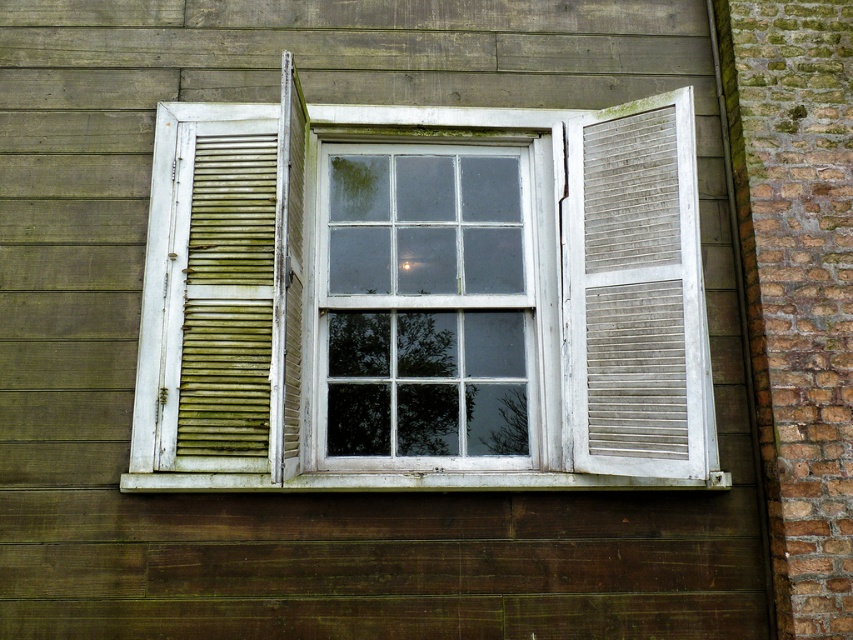
Locate an element on the screen. The height and width of the screenshot is (640, 853). white wood window at center is located at coordinates (422, 298).

Is point (436, 381) positioned behind point (717, 476)?

Yes, point (436, 381) is farther from viewer.

Who is more distant from viewer, (223, 385) or (560, 490)?

The point (223, 385) is behind.

Locate an element on the screen. This screenshot has height=640, width=853. white wood window at center is located at coordinates (422, 298).

Is green weathered wood at left to the left of white wood at center from the viewer's perspective?

Yes, green weathered wood at left is to the left of white wood at center.

This screenshot has height=640, width=853. I want to click on green weathered wood at left, so click(x=228, y=298).

I want to click on green weathered wood at left, so click(x=228, y=298).

Does point (561, 298) lie in front of point (641, 308)?

No, it is behind (641, 308).

Can you confirm if white wood window at center is positioned to the right of white wood slats at right?

No, white wood window at center is not to the right of white wood slats at right.

This screenshot has height=640, width=853. I want to click on white wood window at center, so click(422, 298).

Find the location of a particular element. This screenshot has width=853, height=640. white wood window at center is located at coordinates (422, 298).